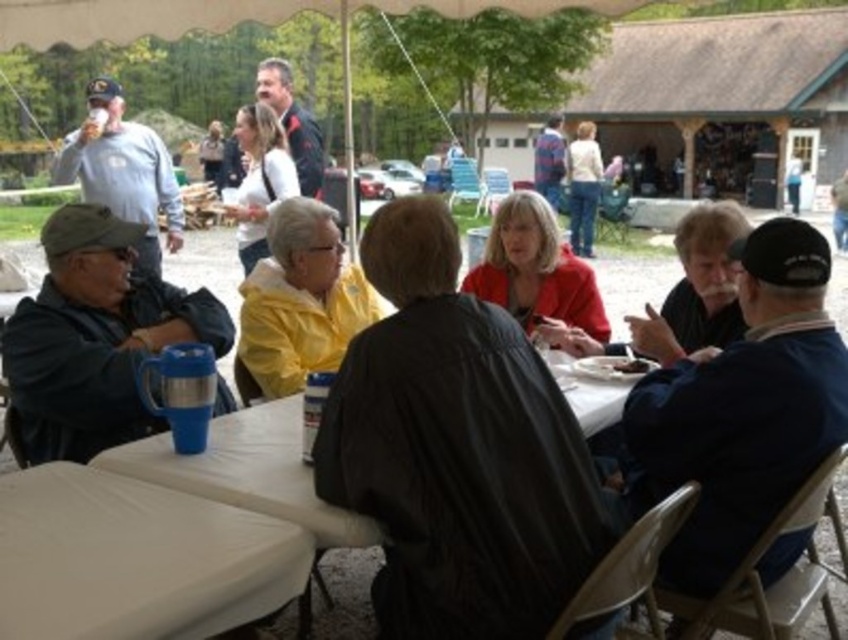
Is blue plastic cup at left to the left of white cotton shirt at upper center from the viewer's perspective?

Yes, blue plastic cup at left is to the left of white cotton shirt at upper center.

Does blue plastic cup at left appear over white cotton shirt at upper center?

Actually, blue plastic cup at left is below white cotton shirt at upper center.

Is point (221, 412) more distant than point (255, 241)?

No.

Find the location of a particular element. blue plastic cup at left is located at coordinates (93, 339).

Is point (718, 500) farther from camera compared to point (248, 116)?

No.

Can you confirm if blue fabric jacket at lower right is positioned to the right of white cotton shirt at upper center?

Yes, blue fabric jacket at lower right is to the right of white cotton shirt at upper center.

Which is behind, point (679, 432) or point (264, 129)?

Positioned behind is point (264, 129).

Find the location of a particular element. This screenshot has width=848, height=640. blue fabric jacket at lower right is located at coordinates (740, 408).

Who is positioned more to the left, white fabric table at lower left or matte red jacket at center?

white fabric table at lower left is more to the left.

Is white fabric table at lower left to the left of matte red jacket at center from the viewer's perspective?

Correct, you'll find white fabric table at lower left to the left of matte red jacket at center.

You are a GUI agent. You are given a task and a screenshot of the screen. Output one action in this format:
    pyautogui.click(x=<x>, y=<y>)
    Task: Click on the white fabric table at lower left
    This screenshot has height=640, width=848.
    Given the screenshot: What is the action you would take?
    pyautogui.click(x=135, y=557)